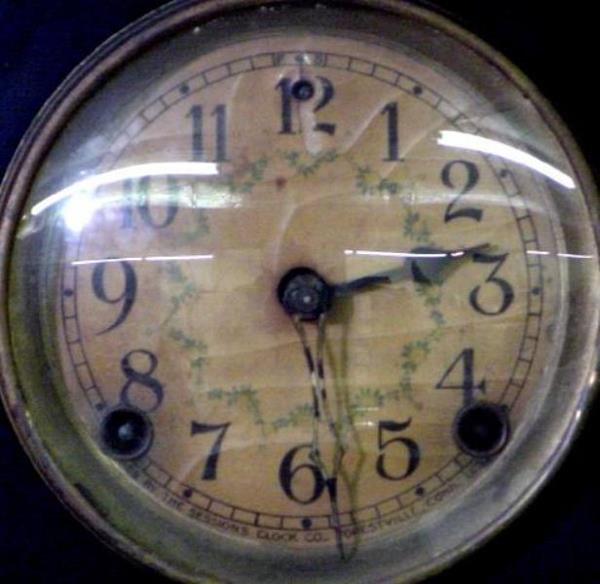
This screenshot has height=584, width=600. In order to click on clock hands in this screenshot , I will do `click(410, 283)`, `click(316, 361)`.